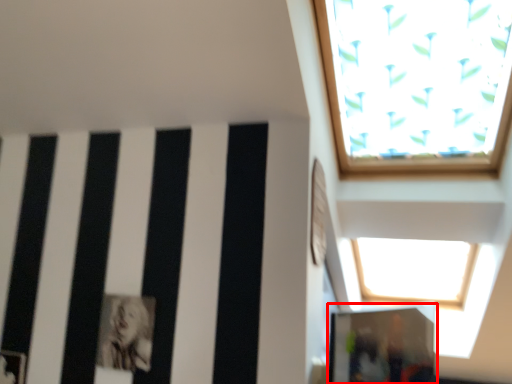
Question: Where is glass door (annotated by the red box) located in relation to person in the image?

Choices:
 (A) right
 (B) left

Answer: (A)